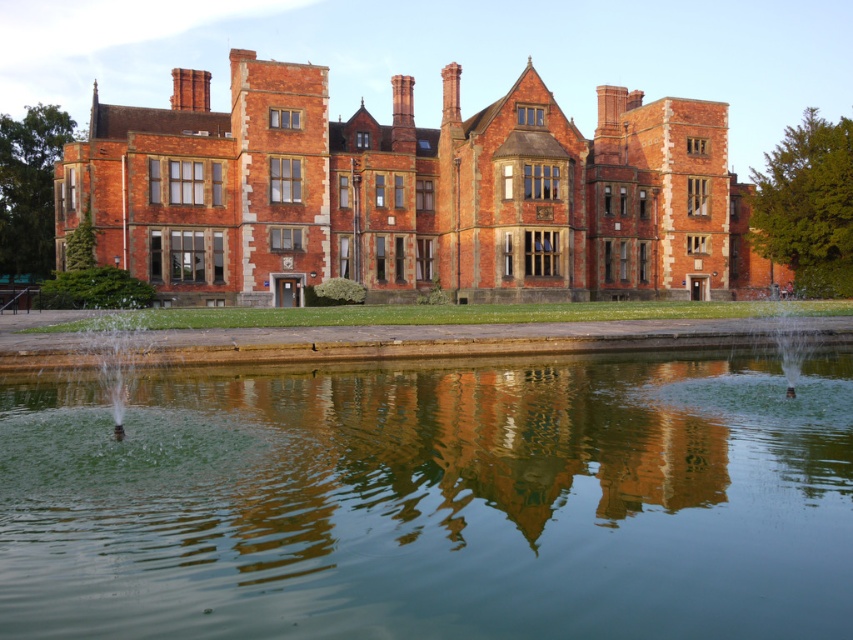
Question: Which of the following is the farthest from the observer?

Choices:
 (A) green reflective water at center
 (B) clear water fountain at lower right

Answer: (B)

Question: In this image, where is matte brick mansion at center located relative to clear water fountain at lower right?

Choices:
 (A) below
 (B) above

Answer: (B)

Question: Which object is closer to the camera taking this photo?

Choices:
 (A) clear water fountain at lower right
 (B) green reflective water at center
 (C) matte brick mansion at center

Answer: (B)

Question: Which of the following is the closest to the observer?

Choices:
 (A) (814, 333)
 (B) (558, 628)
 (C) (321, 88)

Answer: (B)

Question: Can you confirm if green reflective water at center is bigger than matte brick mansion at center?

Choices:
 (A) no
 (B) yes

Answer: (A)

Question: Can you confirm if matte brick mansion at center is thinner than clear water fountain at lower right?

Choices:
 (A) no
 (B) yes

Answer: (A)